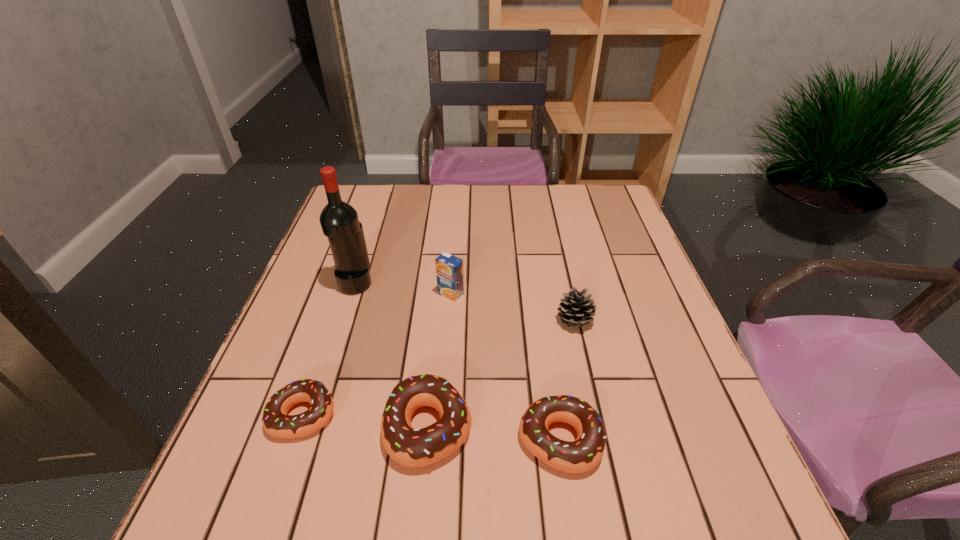
Find the location of `vacant space that satisfies the following two spatial constraints: 1. on the front side of the fifth shortest object; 2. on the left side of the fourth shortest object`. vacant space that satisfies the following two spatial constraints: 1. on the front side of the fifth shortest object; 2. on the left side of the fourth shortest object is located at coordinates (449, 321).

You are a GUI agent. You are given a task and a screenshot of the screen. Output one action in this format:
    pyautogui.click(x=<x>, y=<y>)
    Task: Click on the vacant area in the image that satisfies the following two spatial constraints: 1. on the front side of the shortest doughnut; 2. on the right side of the second doughnut from right to left
    
    Given the screenshot: What is the action you would take?
    [299, 427]